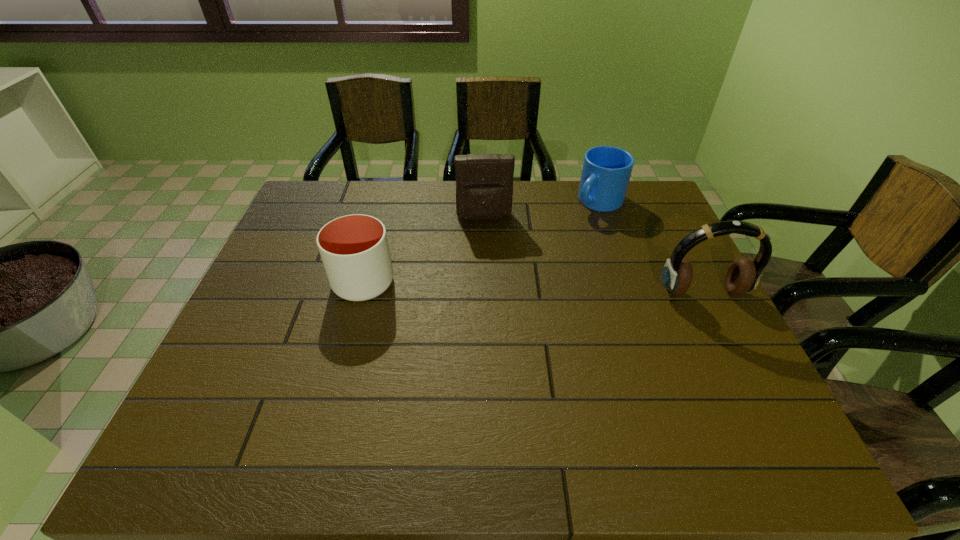
Identify the location of cup. This screenshot has width=960, height=540. (354, 249).

Identify the location of headset. The image size is (960, 540). (744, 274).

Locate an element on the screen. mug is located at coordinates (606, 172).

Find the location of a particular element. the second object from left to right is located at coordinates (484, 182).

Locate an element on the screen. This screenshot has height=540, width=960. vacant position located on the front of the leftmost object is located at coordinates (335, 388).

At what (x,y) coordinates should I click in order to perform the action: click on vacant space located 0.230m on the ear cup of the headset. Please return your answer as a coordinate pair (x, y). The image size is (960, 540). Looking at the image, I should click on (747, 381).

The height and width of the screenshot is (540, 960). I want to click on blank space located on the side of the mug with the handle, so click(x=519, y=273).

Locate an element on the screen. This screenshot has width=960, height=540. free space located 0.300m on the side of the mug with the handle is located at coordinates (532, 262).

This screenshot has height=540, width=960. I want to click on vacant region located on the side of the mug with the handle, so click(571, 227).

Image resolution: width=960 pixels, height=540 pixels. I want to click on vacant space located 0.260m with an open flap on the pouch, so click(493, 284).